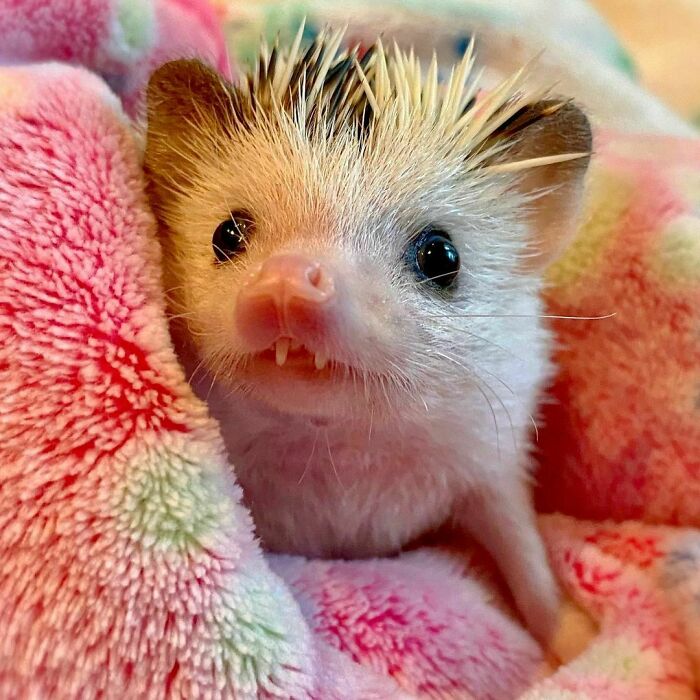
You are a GUI agent. You are given a task and a screenshot of the screen. Output one action in this format:
    pyautogui.click(x=<x>, y=<y>)
    Task: Click on the pink blanket
    Image resolution: width=700 pixels, height=700 pixels.
    Given the screenshot: What is the action you would take?
    pyautogui.click(x=80, y=381), pyautogui.click(x=477, y=638), pyautogui.click(x=640, y=292), pyautogui.click(x=178, y=38)